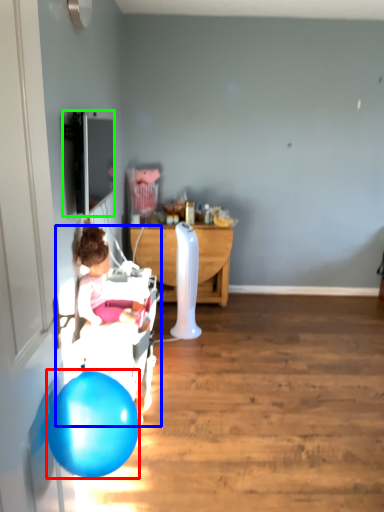
Question: Which object is the farthest from balloon (highlighted by a red box)? Choose among these: baby carriage (highlighted by a blue box) or television (highlighted by a green box).

Choices:
 (A) baby carriage
 (B) television

Answer: (B)